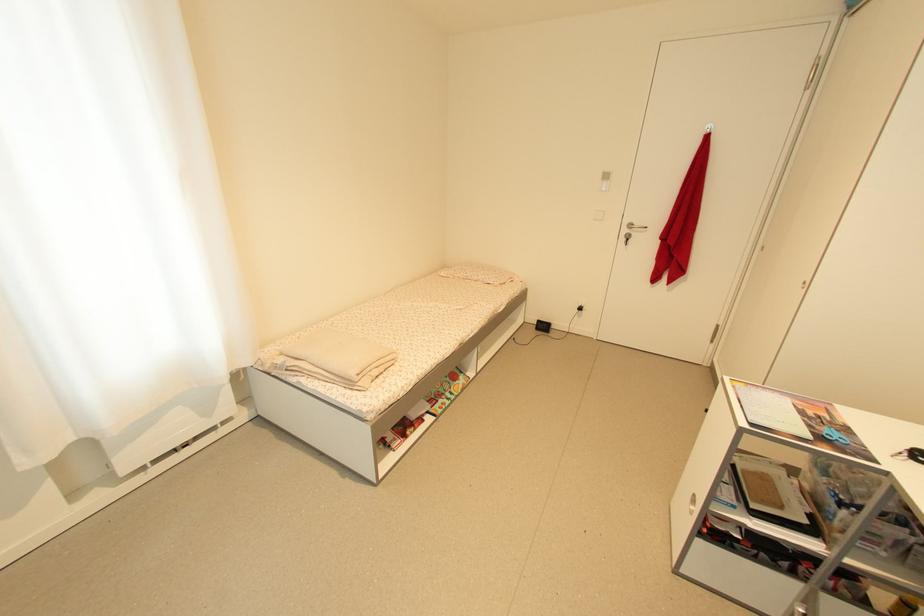
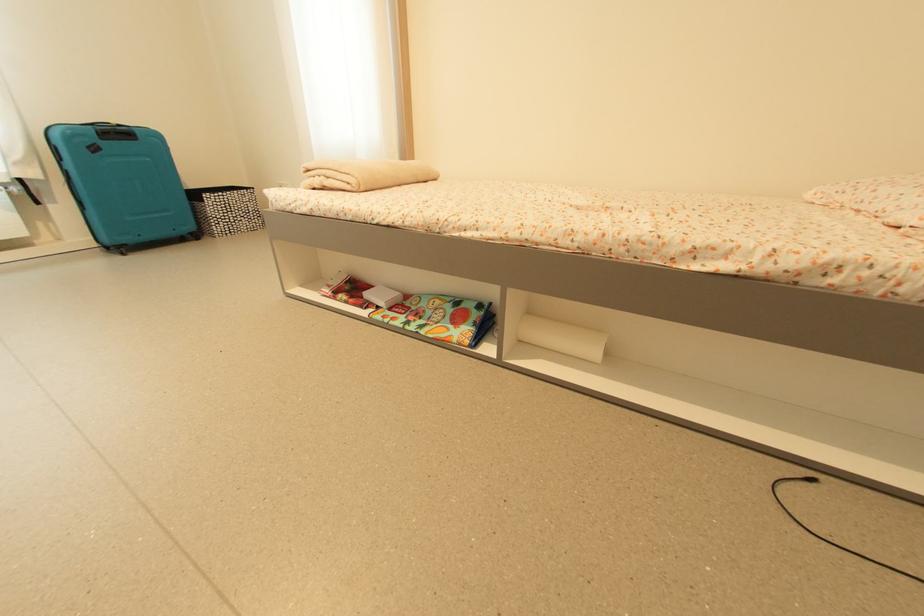
Where in the second image is the point corresponding to pixel 466 387 from the first image?

(447, 337)